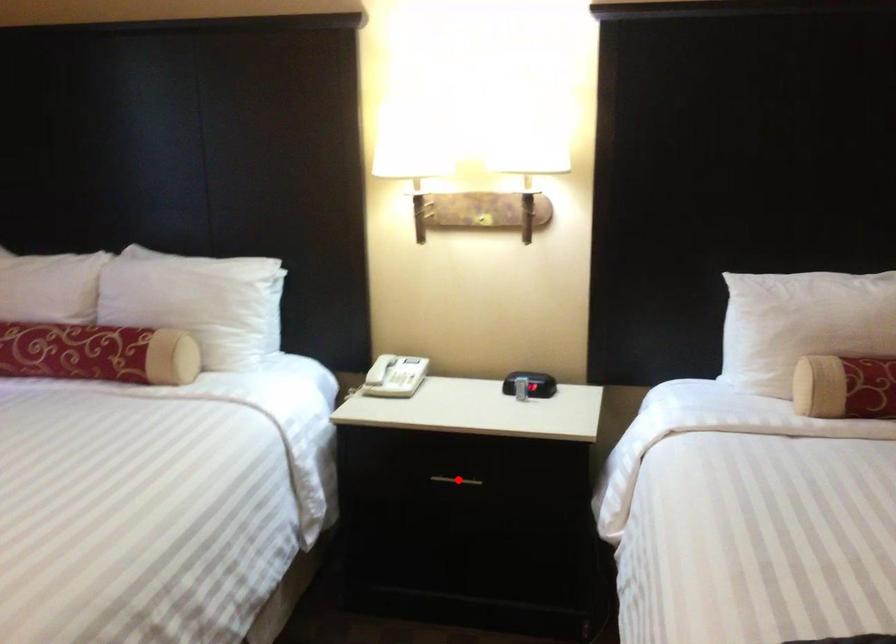
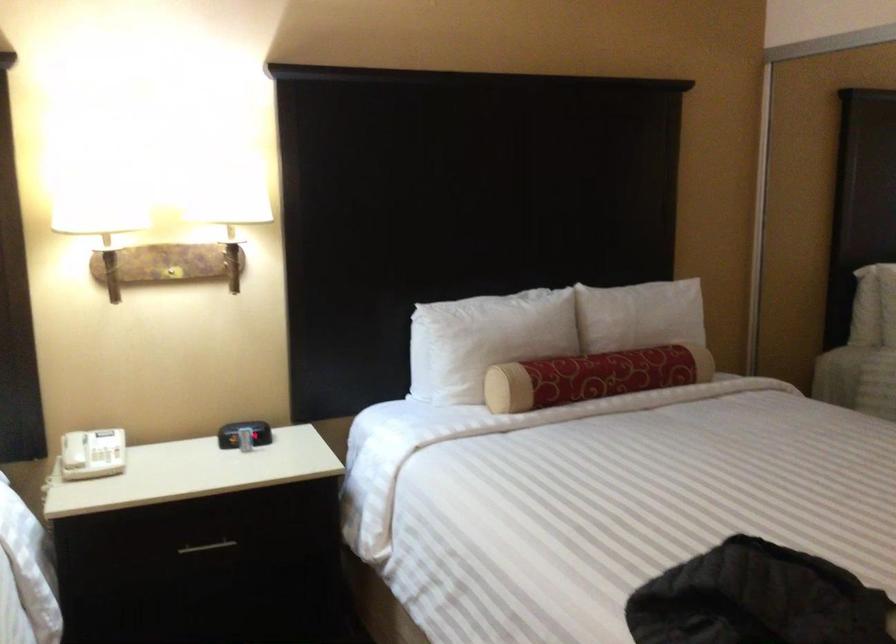
Find the pixel in the second image that matches the highlighted location in the first image.

(207, 547)